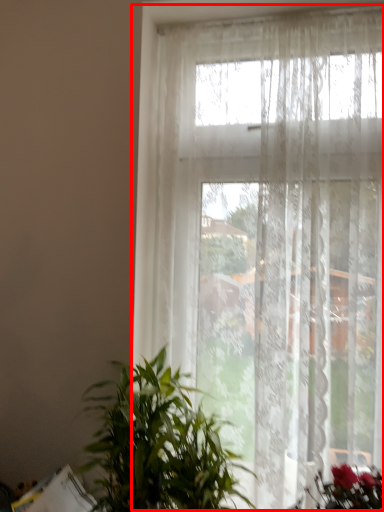
Question: From the image's perspective, what is the correct spatial relationship of window (annotated by the red box) in relation to houseplant?

Choices:
 (A) below
 (B) above

Answer: (B)